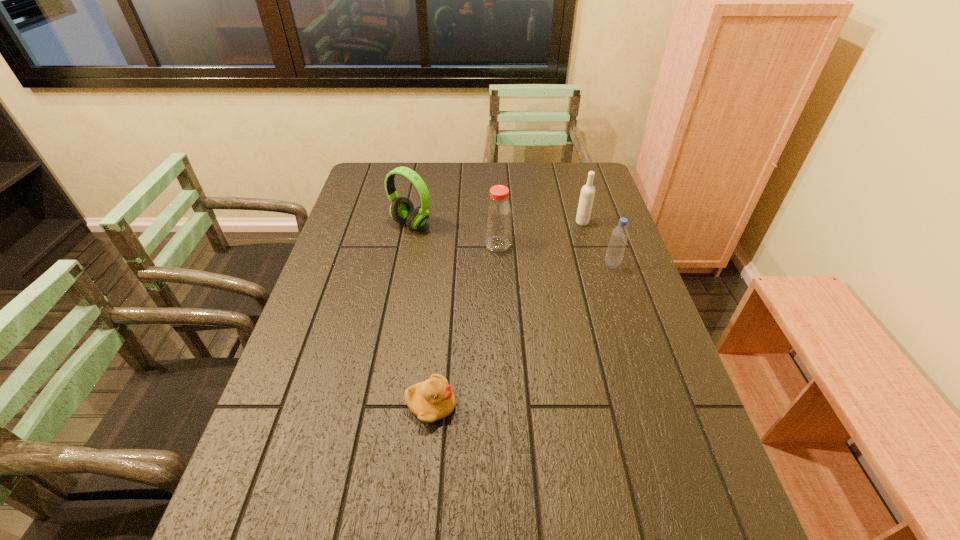
Find the location of a particular element. The height and width of the screenshot is (540, 960). headset is located at coordinates point(402,210).

The width and height of the screenshot is (960, 540). Identify the location of the third object from left to right. (498, 215).

Where is `the farther bottle`? Image resolution: width=960 pixels, height=540 pixels. the farther bottle is located at coordinates (498, 215).

At what (x,y) coordinates should I click in order to perform the action: click on the fourth object from left to right. Please return your answer as a coordinate pair (x, y). The width and height of the screenshot is (960, 540). Looking at the image, I should click on (587, 194).

Find the location of `the fourth farthest object`. the fourth farthest object is located at coordinates (619, 236).

At what (x,y) coordinates should I click in order to perform the action: click on the rightmost object. Please return your answer as a coordinate pair (x, y). Looking at the image, I should click on (619, 236).

Locate an element on the screen. the nearest object is located at coordinates (433, 399).

In order to click on the shortest object in this screenshot , I will do `click(433, 399)`.

Locate an element on the screen. This screenshot has height=540, width=960. vacant space positioned 0.210m on the front of the headset is located at coordinates (400, 280).

What are the coordinates of `free space located on the front of the left bottle` in the screenshot? It's located at (499, 270).